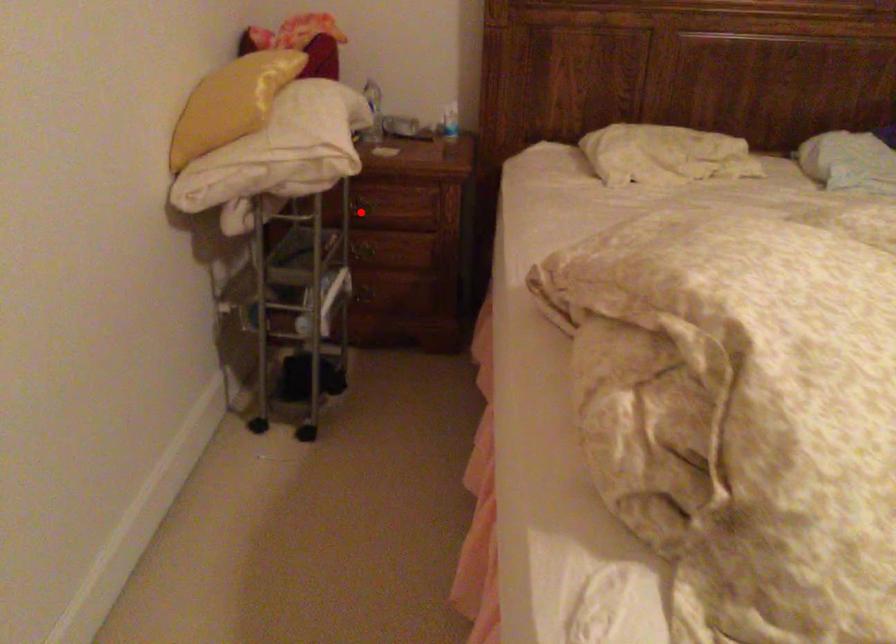
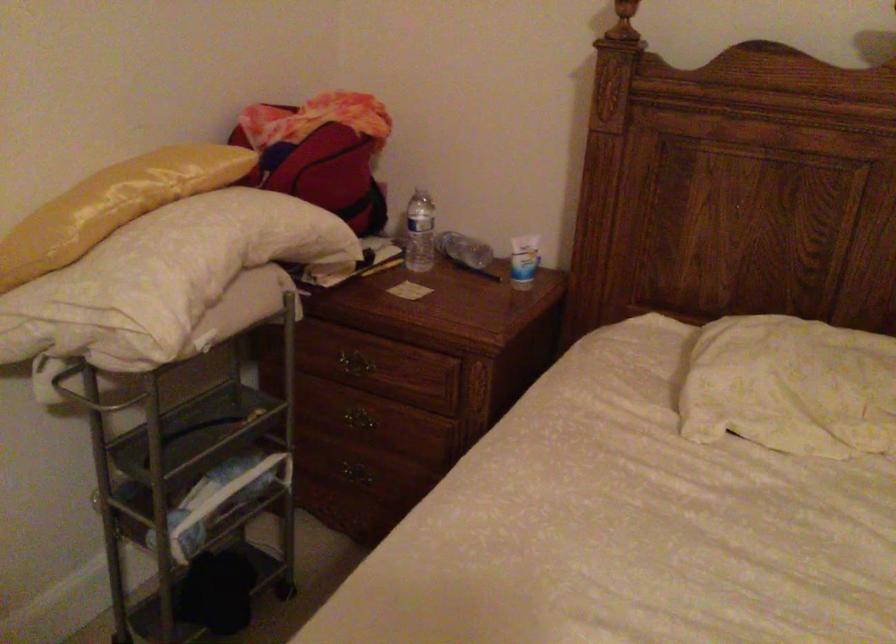
Find the pixel in the second image that matches the highlighted location in the first image.

(350, 365)